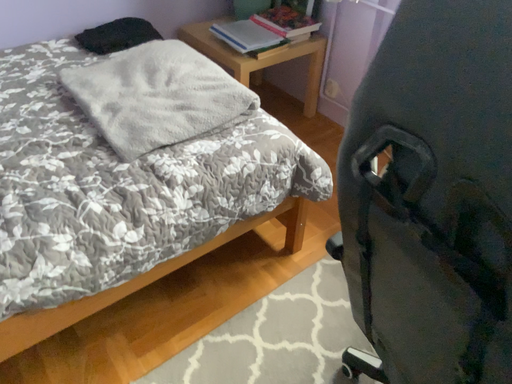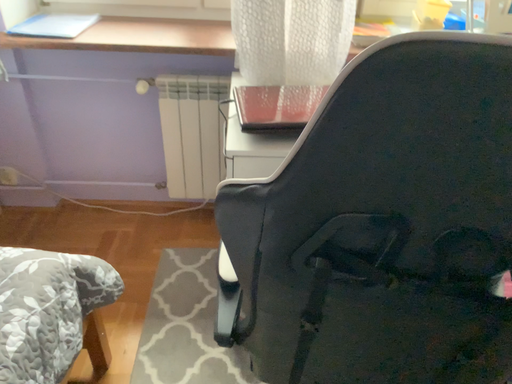
Question: Which way did the camera rotate in the video?

Choices:
 (A) rotated downward
 (B) rotated upward

Answer: (B)